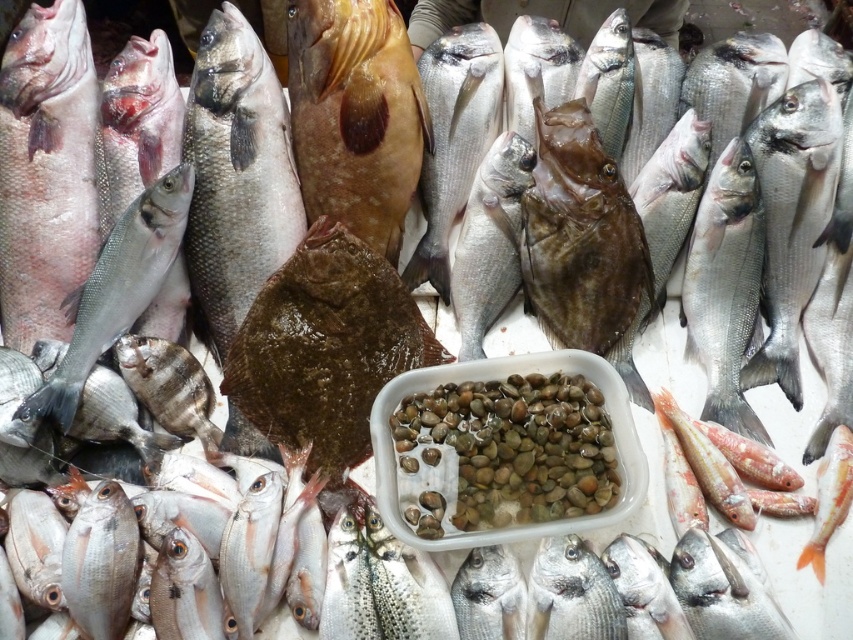
Is silver metallic fish at left above shiny silver fish at center?

Actually, silver metallic fish at left is below shiny silver fish at center.

Can you confirm if silver metallic fish at left is bigger than shiny silver fish at center?

Yes, silver metallic fish at left is bigger than shiny silver fish at center.

Is point (186, 200) positioned in front of point (456, 120)?

Yes, it is in front of point (456, 120).

The image size is (853, 640). Identify the location of silver metallic fish at left. (111, 296).

Does silver metallic fish at left have a greater height compared to shiny brown fish at center?

Indeed, silver metallic fish at left has a greater height compared to shiny brown fish at center.

Is point (67, 390) behind point (525, 157)?

No, it is not.

What do you see at coordinates (111, 296) in the screenshot? This screenshot has width=853, height=640. I see `silver metallic fish at left` at bounding box center [111, 296].

Image resolution: width=853 pixels, height=640 pixels. I want to click on silver metallic fish at left, so (111, 296).

Between point (49, 29) and point (508, 212), which one is positioned behind?

The point (508, 212) is more distant.

Can you confirm if matte pinkish fish at left is shorter than shiny brown fish at center?

Incorrect, matte pinkish fish at left's height does not fall short of shiny brown fish at center's.

Is point (82, 156) farther from camera compared to point (509, 269)?

That is False.

I want to click on matte pinkish fish at left, so click(x=45, y=170).